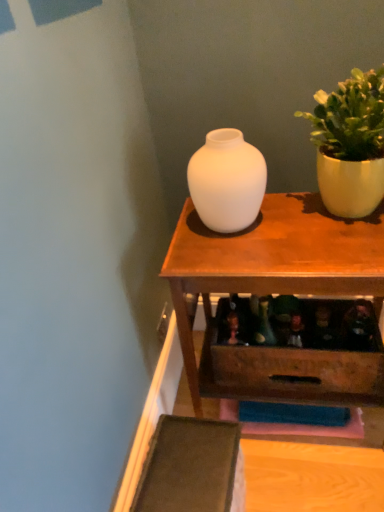
This screenshot has width=384, height=512. In order to click on free region under matte yellow pot at upper right (from a real-world perspective) in this screenshot , I will do `click(328, 215)`.